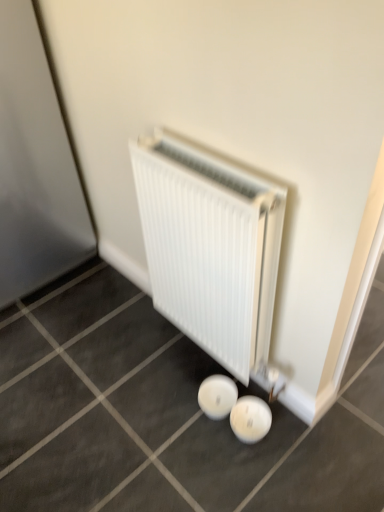
In the scene shown: What is the approximate height of white plastic radiator at center?

white plastic radiator at center is 31.78 inches tall.

The height and width of the screenshot is (512, 384). Describe the element at coordinates (210, 246) in the screenshot. I see `white plastic radiator at center` at that location.

I want to click on white plastic radiator at center, so click(x=210, y=246).

Where is `white plastic radiator at center`? Image resolution: width=384 pixels, height=512 pixels. white plastic radiator at center is located at coordinates (210, 246).